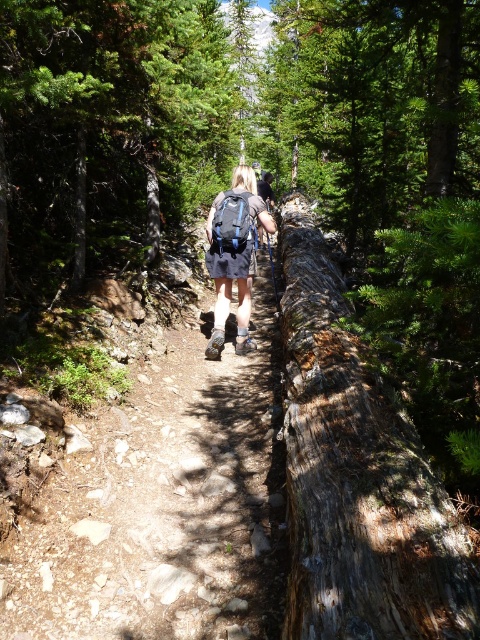
From the picture: Can you confirm if matte black backpack at center is positioned above matte blue backpack at center?

Incorrect, matte black backpack at center is not positioned above matte blue backpack at center.

Identify the location of matte black backpack at center. (233, 253).

Based on the photo, does brown dirt trail at center have a greater width compared to matte blue backpack at center?

Indeed, brown dirt trail at center has a greater width compared to matte blue backpack at center.

Which is in front, point (180, 593) or point (249, 228)?

Point (180, 593) is in front.

This screenshot has width=480, height=640. In order to click on brown dirt trail at center in this screenshot , I will do `click(165, 500)`.

How much distance is there between brown dirt trail at center and matte black backpack at center?

They are 5.28 feet apart.

Between brown dirt trail at center and matte black backpack at center, which one has more height?

With more height is matte black backpack at center.

This screenshot has width=480, height=640. I want to click on brown dirt trail at center, so click(165, 500).

Image resolution: width=480 pixels, height=640 pixels. In order to click on brown dirt trail at center in this screenshot , I will do `click(165, 500)`.